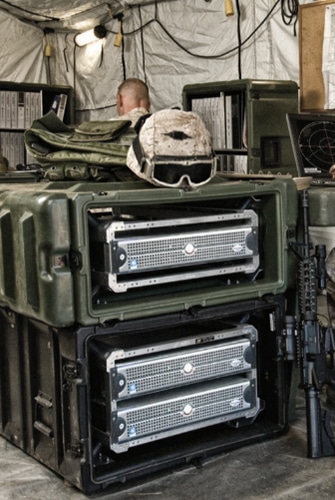
The width and height of the screenshot is (335, 500). Identify the location of grey concrete flooring. (266, 480).